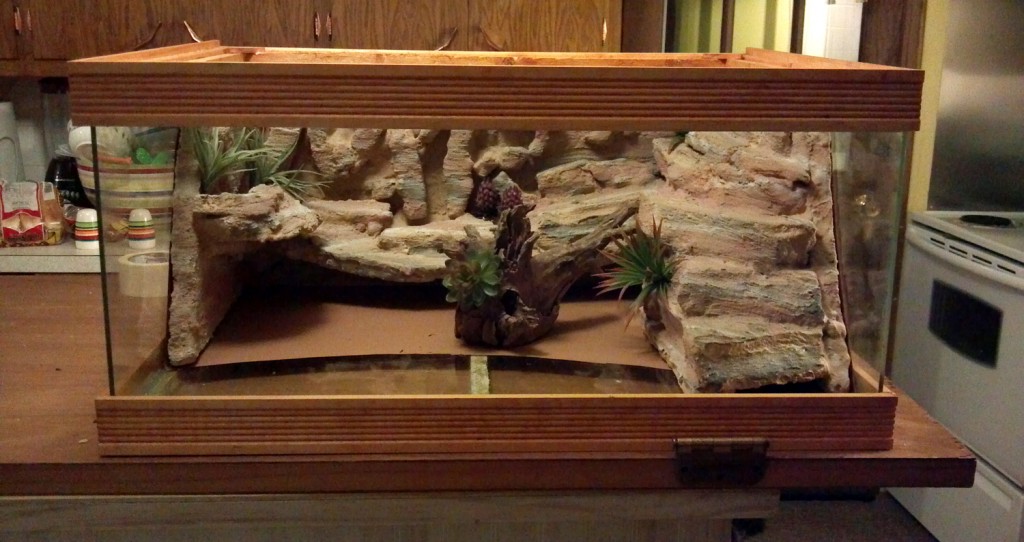
Locate an element on the screen. hinges is located at coordinates (17, 20), (329, 7), (606, 30).